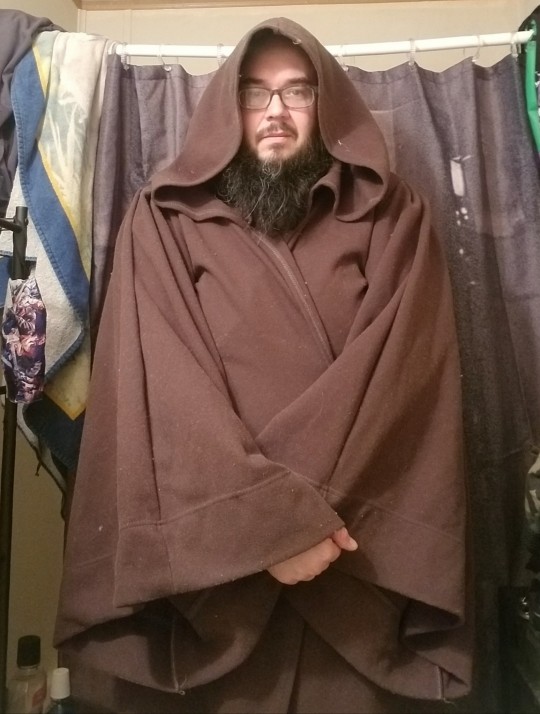
Find the location of a particular element. The image size is (540, 714). curtain is located at coordinates (453, 124).